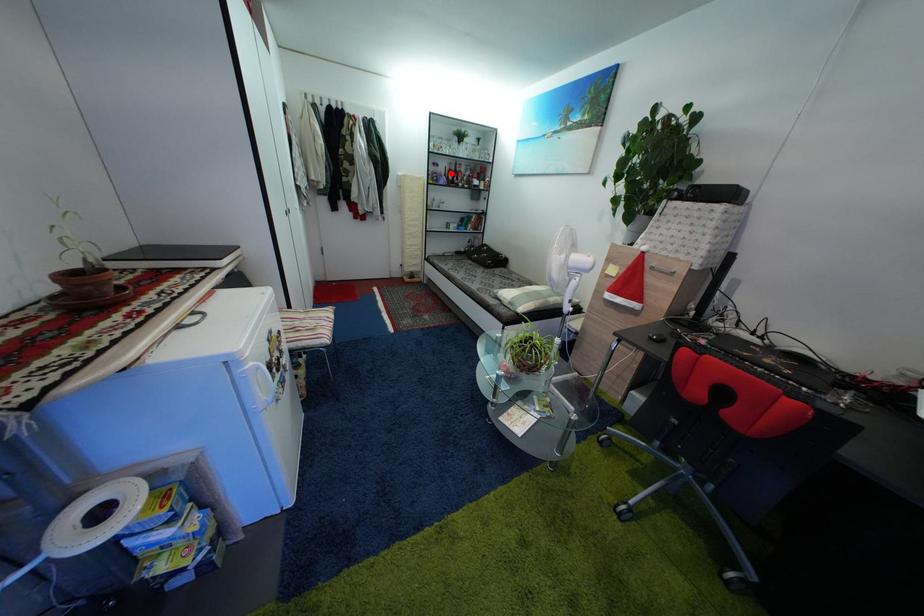
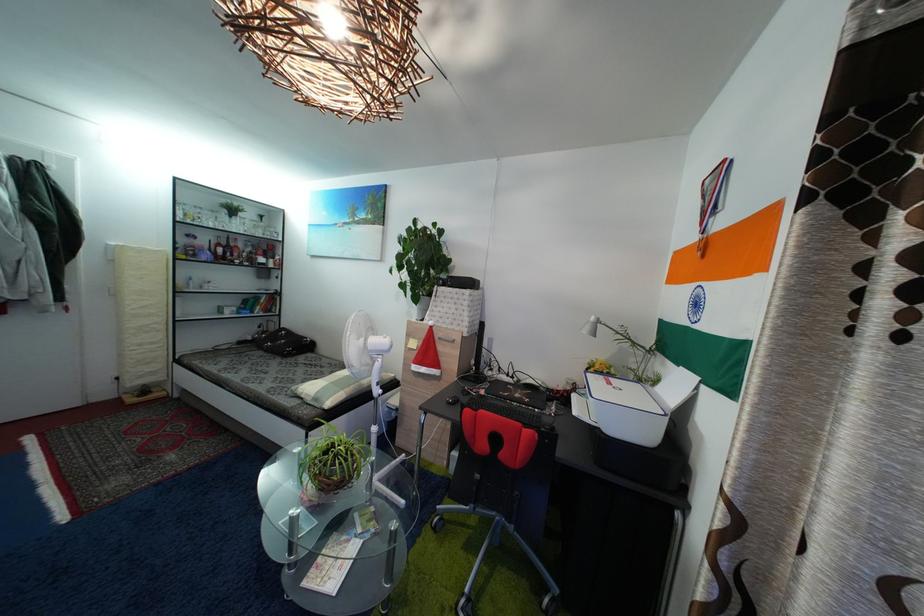
Question: A red point is marked in image1. In image2, is the corresponding 3D point closer to the camera or farther? Reply with the corresponding letter.

Choices:
 (A) The corresponding 3D point is closer.
 (B) The corresponding 3D point is farther.

Answer: (B)